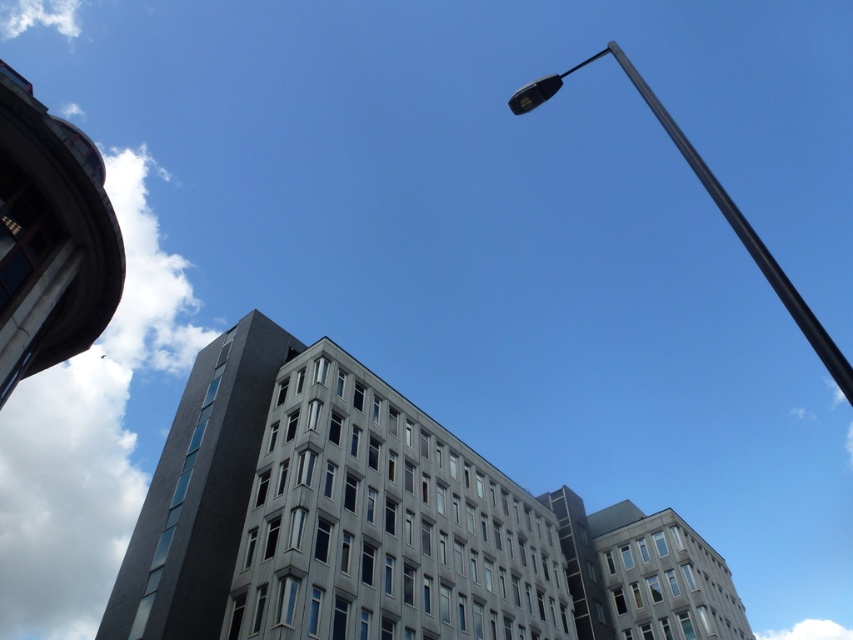
You are standing at the point marked by the coordinates point (328, 513), which is the center of the gray concrete building. Looking towards the rounded structure on the left, which direction should you turn to face the streetlamp in the upper right?

The gray concrete building at center is represented by point (328, 513). Since the rounded structure is on the left and the streetlamp is in the upper right, you should turn to your right to face the streetlamp in the upper right.

You are standing at the point with coordinates point (85, 237) and want to look at the point with coordinates point (305, 387). Can you see it without moving your position?

Point (305, 387) is behind point (85, 237), so you cannot see it without moving your position.

You are a drone operator trying to navigate between two buildings. You have a drone that must stay within a 100m radius from its starting point. If the dark gray concrete tower at upper left is at coordinate point 0.767, 0.234, can you determine whether the drone is within the safe radius?

The dark gray concrete tower at upper left is located at coordinate point (x=199, y=490). Since the coordinates are within the 100m radius, the drone is within the safe radius.